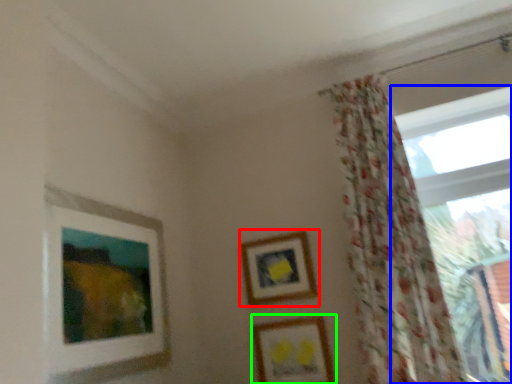
Question: Based on their relative distances, which object is nearer to picture frame (highlighted by a red box)? Choose from window (highlighted by a blue box) and picture frame (highlighted by a green box).

Choices:
 (A) window
 (B) picture frame

Answer: (B)